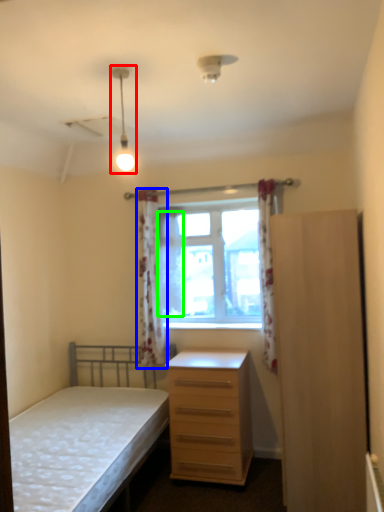
Question: Based on their relative distances, which object is farther from light fixture (highlighted by a red box)? Choose from curtain (highlighted by a blue box) and curtain (highlighted by a green box).

Choices:
 (A) curtain
 (B) curtain

Answer: (A)